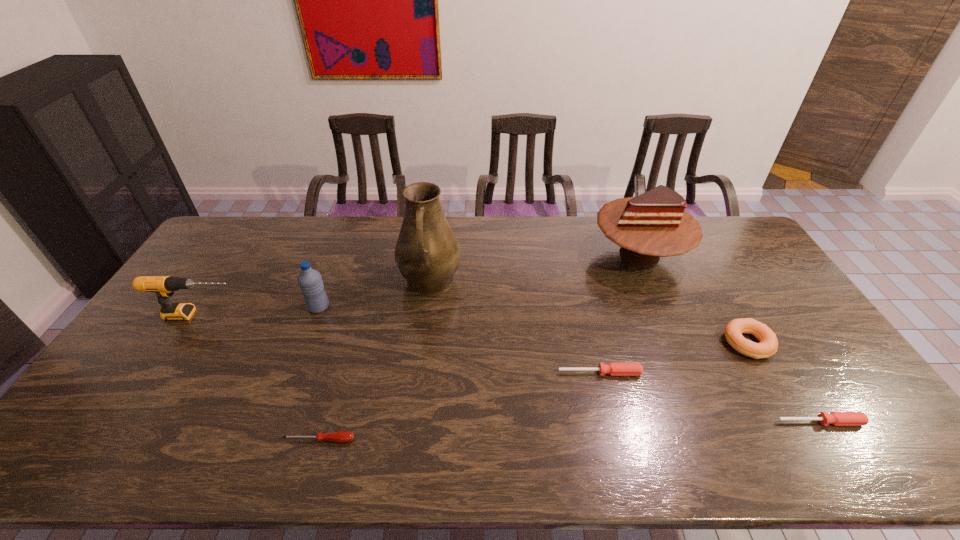
This screenshot has height=540, width=960. I want to click on free space between the fourth nearest object and the rightmost screwdriver, so click(x=784, y=382).

Where is `unoccupied position between the fifth object from right to left and the fourth nearest object`? This screenshot has height=540, width=960. unoccupied position between the fifth object from right to left and the fourth nearest object is located at coordinates (588, 313).

Find the location of a particular element. The height and width of the screenshot is (540, 960). object that can be found as the sixth closest to the second nearest object is located at coordinates (310, 282).

Locate which object is the fifth closest to the second tallest object. Please provide its 2D coordinates. Your answer should be formatted as a tuple, i.e. [(x, y)], where the tuple contains the x and y coordinates of a point satisfying the conditions above.

[(341, 436)]

Locate an element on the screen. screwdriver that stands as the closest to the bagel is located at coordinates (835, 418).

Image resolution: width=960 pixels, height=540 pixels. Find the location of `screwdriver that stands as the closest to the second screwdriver from right to left`. screwdriver that stands as the closest to the second screwdriver from right to left is located at coordinates click(x=835, y=418).

What are the coordinates of `vacant space that satisfies the following two spatial constraints: 1. on the handle side of the second farthest screwdriver; 2. on the left side of the fourth tallest object` in the screenshot? It's located at (130, 422).

Locate an element on the screen. vacant area in the image that satisfies the following two spatial constraints: 1. on the back side of the second farthest screwdriver; 2. on the right side of the leftmost screwdriver is located at coordinates (324, 422).

Locate an element on the screen. free location that satisfies the following two spatial constraints: 1. on the handle side of the fifth shortest object; 2. on the right side of the second screwdriver from right to left is located at coordinates (161, 373).